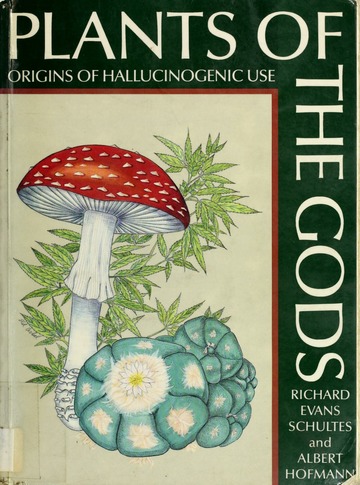
Where is `white bulb`? white bulb is located at coordinates (68, 420).